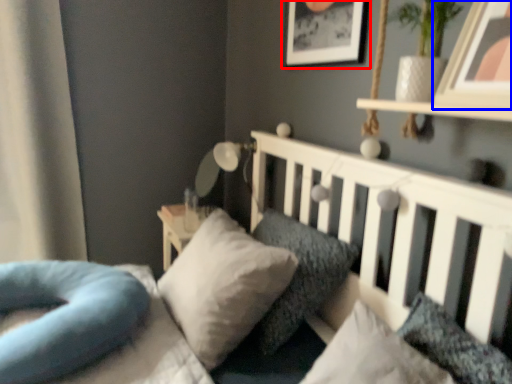
Question: Which object is further to the camera taking this photo, picture frame (highlighted by a red box) or picture frame (highlighted by a blue box)?

Choices:
 (A) picture frame
 (B) picture frame

Answer: (A)